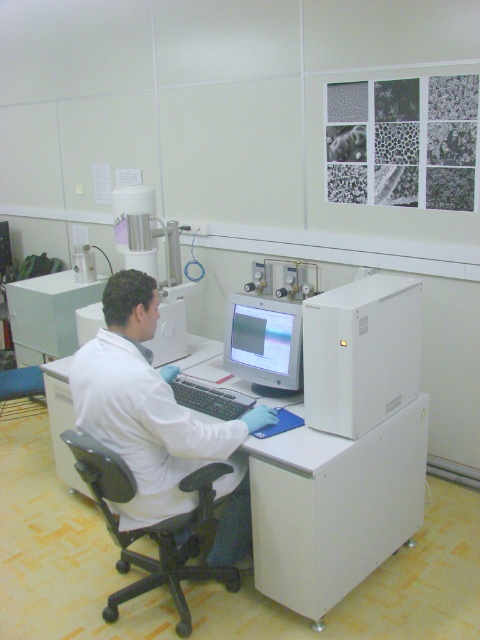
You are a researcher who needs to adjust the height of your chair to match the height of the matte gray monitor at center. Currently, you are sitting on the black plastic chair at lower left. Based on the scene description, is your current chair higher or lower than the monitor?

The black plastic chair at lower left has a greater height compared to matte gray monitor at center, so your current chair is higher than the monitor.

You are a new lab assistant and need to choose between wearing the white lab coat at center and sitting on the black plastic chair at lower left. Which item has a greater width?

The white lab coat at center has a larger width than the black plastic chair at lower left.

You are a visitor in the lab and need to sit down. You see the white lab coat at center and the black plastic chair at lower left. Which object is closer to your right side when facing the chair?

The white lab coat at center is positioned on the right side of the black plastic chair at lower left, so when facing the chair, the white lab coat at center would be to your right.